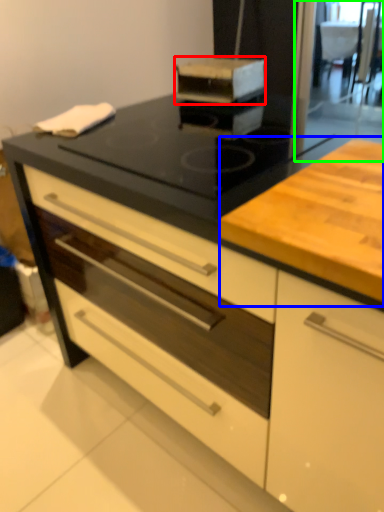
Question: Considering the real-world distances, which object is closest to kitchen appliance (highlighted by a red box)? counter (highlighted by a blue box) or screen door (highlighted by a green box).

Choices:
 (A) counter
 (B) screen door

Answer: (B)